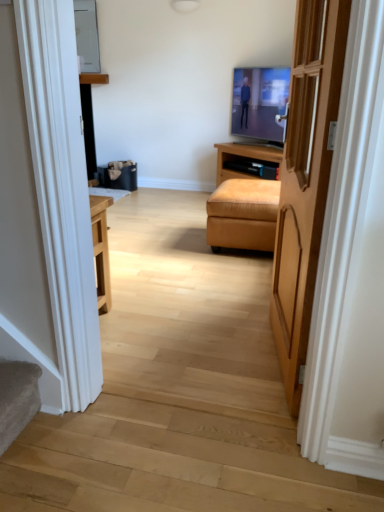
Measure the distance between point (321, 180) and camera.

The depth of point (321, 180) is 3.91 feet.

Describe the element at coordinates (305, 179) in the screenshot. I see `light brown wooden door at center` at that location.

I want to click on suede-like tan ottoman at center, so click(x=243, y=214).

Find the location of a particular element. light brown wooden door at center is located at coordinates (305, 179).

In terms of width, does flat screen tv at center look wider or thinner when compared to light brown wooden door at center?

Considering their sizes, flat screen tv at center looks broader than light brown wooden door at center.

From the image's perspective, which one is positioned lower, flat screen tv at center or light brown wooden door at center?

From the image's view, light brown wooden door at center is below.

Where is `television that appears above the light brown wooden door at center (from a real-world perspective)`? Image resolution: width=384 pixels, height=512 pixels. television that appears above the light brown wooden door at center (from a real-world perspective) is located at coordinates (260, 102).

How many degrees apart are the facing directions of flat screen tv at center and light brown wooden door at center?

The angular difference between flat screen tv at center and light brown wooden door at center is 37.7 degrees.

How many degrees apart are the facing directions of suede-like tan ottoman at center and flat screen tv at center?

48.8 degrees.

Is suede-like tan ottoman at center looking in the opposite direction of flat screen tv at center?

No, suede-like tan ottoman at center is not facing the opposite direction of flat screen tv at center.

From a real-world perspective, between suede-like tan ottoman at center and flat screen tv at center, who is vertically lower?

suede-like tan ottoman at center is physically lower.

Is suede-like tan ottoman at center next to flat screen tv at center?

No, suede-like tan ottoman at center is not in contact with flat screen tv at center.

Is suede-like tan ottoman at center not near light brown wooden door at center?

Yes, suede-like tan ottoman at center is far from light brown wooden door at center.

Where is `studio couch above the light brown wooden door at center (from the image's perspective)`? This screenshot has height=512, width=384. studio couch above the light brown wooden door at center (from the image's perspective) is located at coordinates (243, 214).

Between suede-like tan ottoman at center and light brown wooden door at center, which one has more height?

light brown wooden door at center is taller.

From the image's perspective, is suede-like tan ottoman at center on light brown wooden door at center?

Yes, from the image's perspective, suede-like tan ottoman at center is over light brown wooden door at center.

Image resolution: width=384 pixels, height=512 pixels. I want to click on television above the light brown wooden door at center (from a real-world perspective), so click(260, 102).

Looking at this image, is light brown wooden door at center looking in the opposite direction of flat screen tv at center?

No, light brown wooden door at center is not facing away from flat screen tv at center.

Consider the image. Does light brown wooden door at center have a greater width compared to flat screen tv at center?

In fact, light brown wooden door at center might be narrower than flat screen tv at center.

Is light brown wooden door at center inside the boundaries of flat screen tv at center, or outside?

light brown wooden door at center is spatially situated outside flat screen tv at center.

From a real-world perspective, which object rests below the other?

From a 3D spatial view, suede-like tan ottoman at center is below.

The height and width of the screenshot is (512, 384). I want to click on door on the left of suede-like tan ottoman at center, so click(x=305, y=179).

How much distance is there between light brown wooden door at center and suede-like tan ottoman at center?

light brown wooden door at center and suede-like tan ottoman at center are 3.64 feet apart.

Which is more to the left, light brown wooden door at center or suede-like tan ottoman at center?

From the viewer's perspective, light brown wooden door at center appears more on the left side.

Is flat screen tv at center to the right of suede-like tan ottoman at center from the viewer's perspective?

Yes, flat screen tv at center is to the right of suede-like tan ottoman at center.

Is suede-like tan ottoman at center completely or partially inside flat screen tv at center?

Definitely not — suede-like tan ottoman at center is not inside flat screen tv at center.

Is flat screen tv at center positioned behind suede-like tan ottoman at center?

Yes, flat screen tv at center is behind suede-like tan ottoman at center.

At what (x,y) coordinates should I click in order to perform the action: click on television to the right of suede-like tan ottoman at center. Please return your answer as a coordinate pair (x, y). Looking at the image, I should click on (260, 102).

The image size is (384, 512). In order to click on door on the left of flat screen tv at center in this screenshot , I will do `click(305, 179)`.

Identify the location of studio couch in front of the flat screen tv at center. (243, 214).

Considering their positions, is flat screen tv at center positioned further to light brown wooden door at center than suede-like tan ottoman at center?

Among the two, flat screen tv at center is located further to light brown wooden door at center.

Considering their positions, is light brown wooden door at center positioned closer to suede-like tan ottoman at center than flat screen tv at center?

light brown wooden door at center lies closer to suede-like tan ottoman at center than the other object.

Considering their positions, is suede-like tan ottoman at center positioned closer to flat screen tv at center than light brown wooden door at center?

suede-like tan ottoman at center is closer to flat screen tv at center.

Which object lies further to the anchor point light brown wooden door at center, suede-like tan ottoman at center or flat screen tv at center?

flat screen tv at center is further to light brown wooden door at center.

Considering their positions, is light brown wooden door at center positioned closer to flat screen tv at center than suede-like tan ottoman at center?

The object closer to flat screen tv at center is suede-like tan ottoman at center.

Considering their positions, is flat screen tv at center positioned closer to suede-like tan ottoman at center than light brown wooden door at center?

light brown wooden door at center is positioned closer to the anchor suede-like tan ottoman at center.

Find the location of a particular element. This screenshot has width=384, height=512. studio couch between light brown wooden door at center and flat screen tv at center along the z-axis is located at coordinates (243, 214).